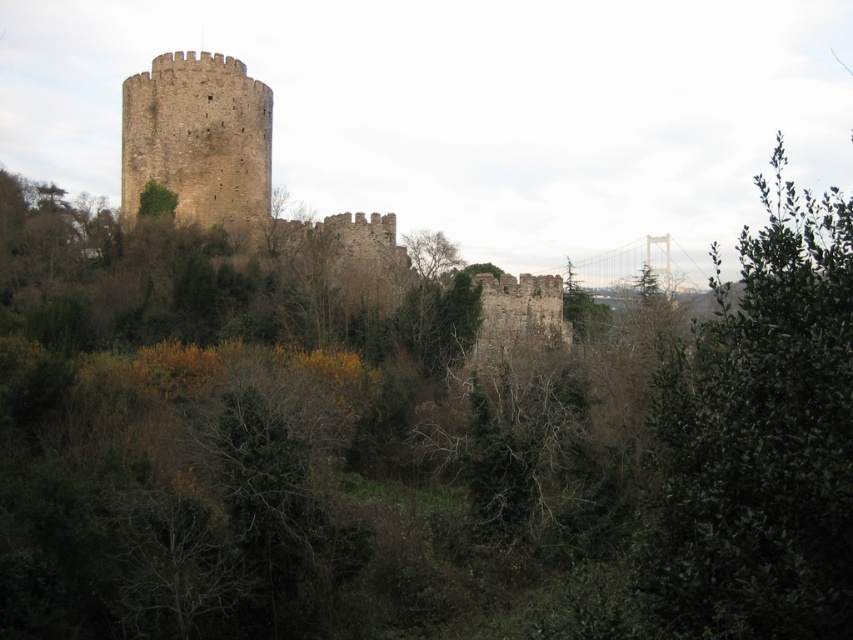
Question: Based on their relative distances, which object is farther from the brown stone tower at center?

Choices:
 (A) brown stone tower at center-left
 (B) green leafy tree at right

Answer: (B)

Question: Which of the following is the closest to the observer?

Choices:
 (A) green leafy tree at right
 (B) brown stone tower at center-left

Answer: (A)

Question: Is brown stone tower at center-left to the right of brown stone tower at center from the viewer's perspective?

Choices:
 (A) no
 (B) yes

Answer: (B)

Question: Does green leafy tree at right have a smaller size compared to brown stone tower at center?

Choices:
 (A) no
 (B) yes

Answer: (A)

Question: Is green leafy tree at right to the right of brown stone tower at center-left from the viewer's perspective?

Choices:
 (A) yes
 (B) no

Answer: (A)

Question: Which is nearer to the green leafy tree at right?

Choices:
 (A) brown stone tower at center
 (B) brown stone tower at center-left

Answer: (B)